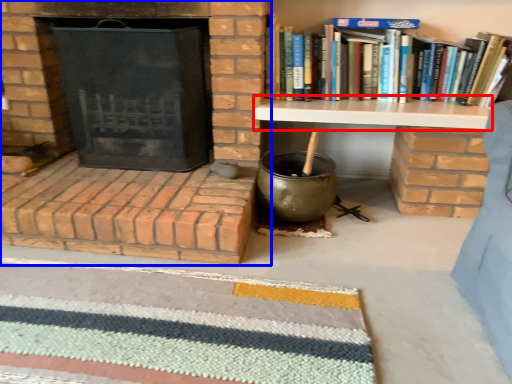
Question: Which of the following is the farthest to the observer, table (highlighted by a red box) or fireplace (highlighted by a blue box)?

Choices:
 (A) table
 (B) fireplace

Answer: (A)